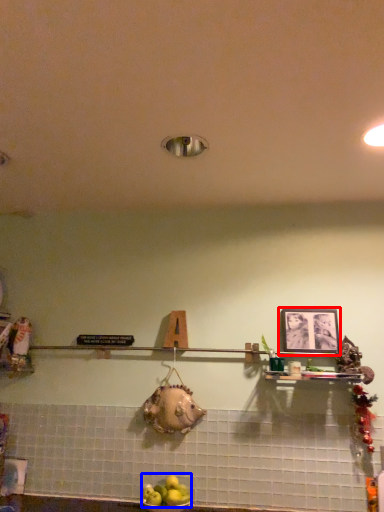
Question: Which of the following is the closest to the observer, picture frame (highlighted by a red box) or apple (highlighted by a blue box)?

Choices:
 (A) picture frame
 (B) apple

Answer: (B)